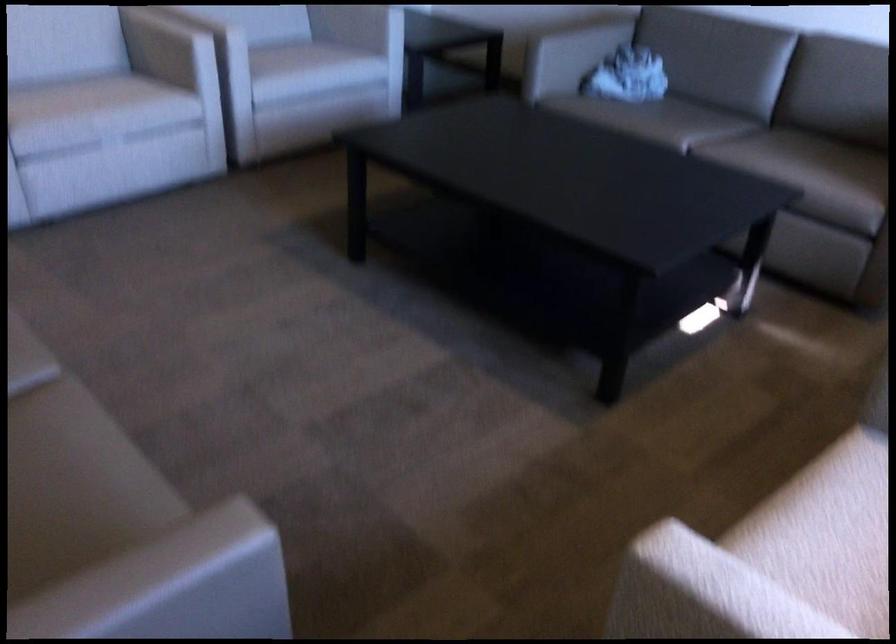
Image resolution: width=896 pixels, height=644 pixels. What are the coordinates of `sofa armrest` in the screenshot? It's located at (556, 26).